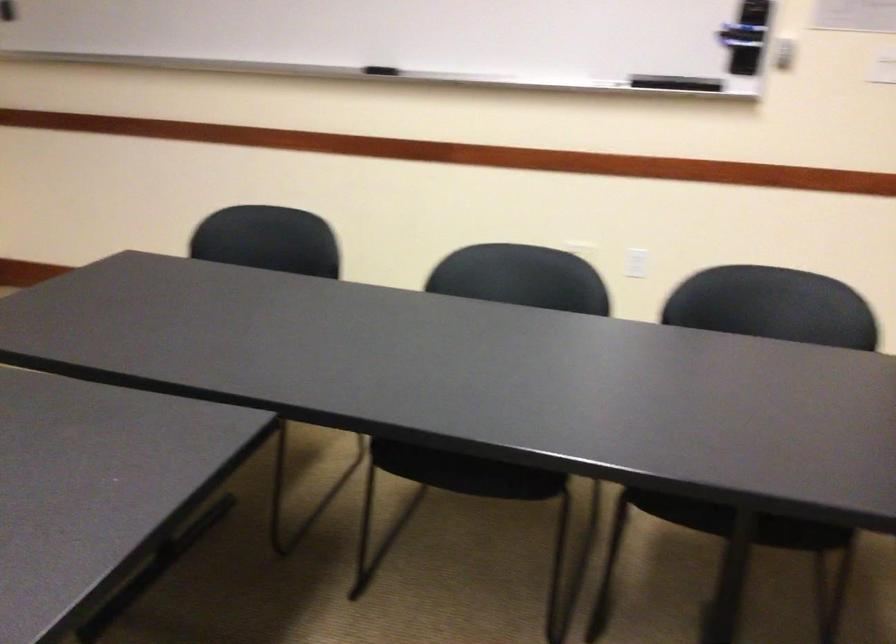
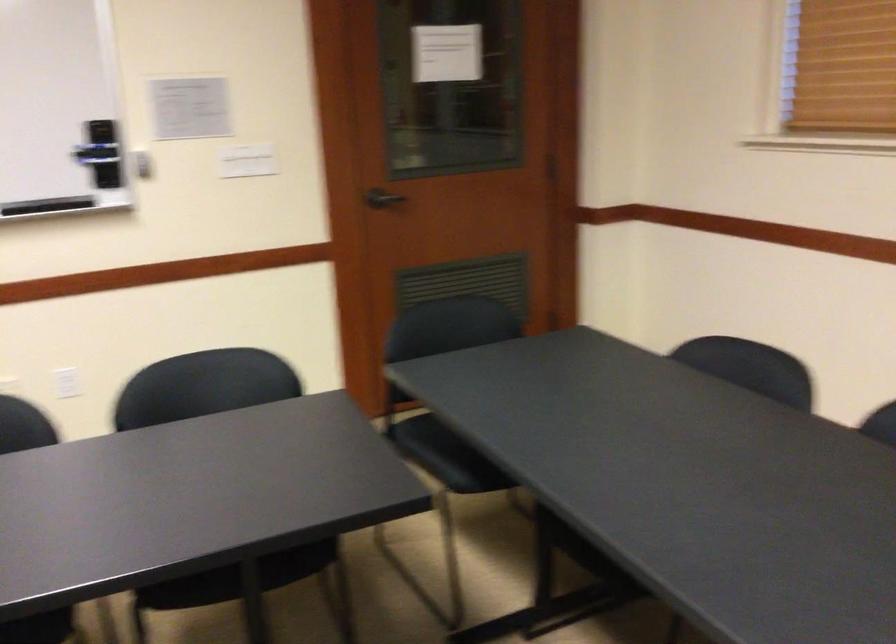
The point at (670, 90) is marked in the first image. Where is the corresponding point in the second image?

(46, 205)